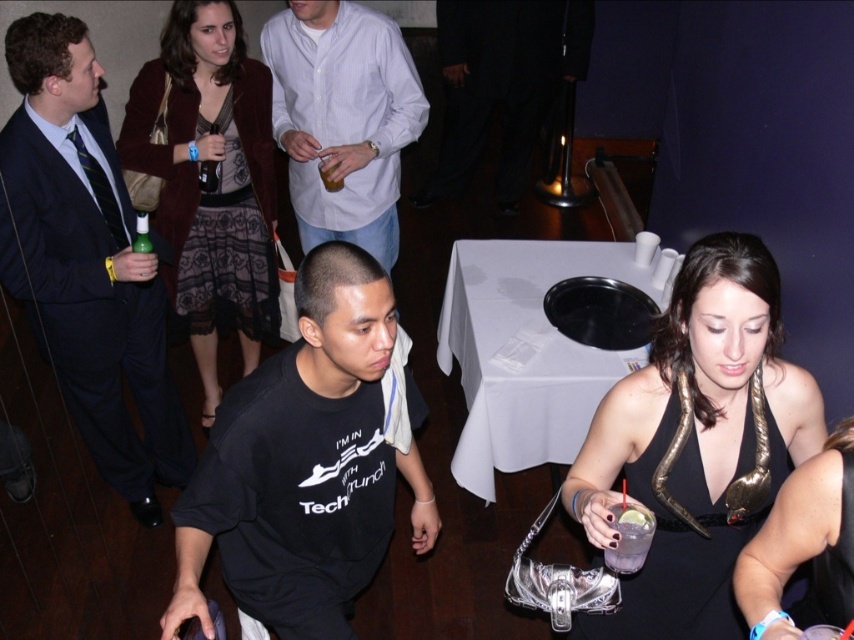
Question: Which point is closer to the camera?

Choices:
 (A) green matte bottle at left
 (B) light blue button-down shirt at center
 (C) clear plastic cup at center
 (D) black satin dress at lower right

Answer: (D)

Question: Considering the real-world distances, which object is farthest from the light blue button-down shirt at center?

Choices:
 (A) clear plastic cup at center
 (B) clear glass drink at lower right
 (C) black cotton t-shirt at center
 (D) dark blue suit at left

Answer: (B)

Question: In this image, where is black cotton t-shirt at center located relative to black leather dress at lower right?

Choices:
 (A) above
 (B) below

Answer: (A)

Question: Does light blue button-down shirt at center appear over black leather dress at lower right?

Choices:
 (A) yes
 (B) no

Answer: (A)

Question: Which point is closer to the camera taking this photo?

Choices:
 (A) (367, 285)
 (B) (828, 442)

Answer: (A)

Question: Where is black leather dress at lower right located in relation to clear glass drink at lower right in the image?

Choices:
 (A) left
 (B) right

Answer: (B)